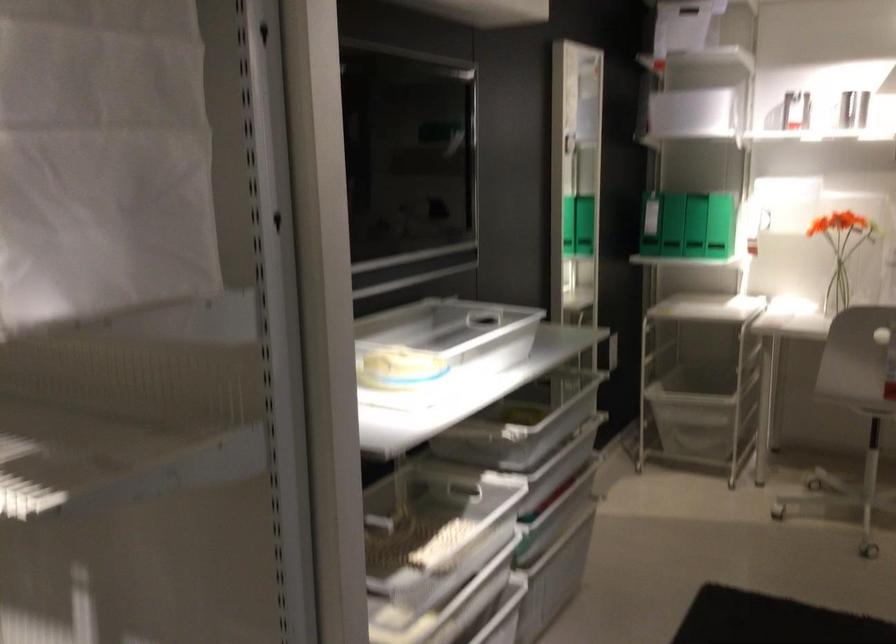
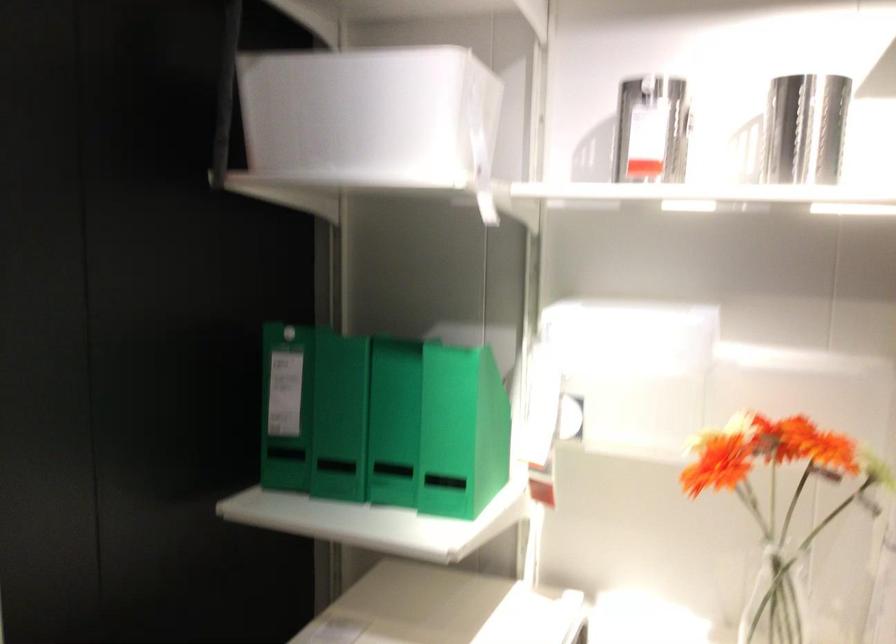
Where in the second image is the point corresponding to point 704,205 from the first image?

(339, 417)